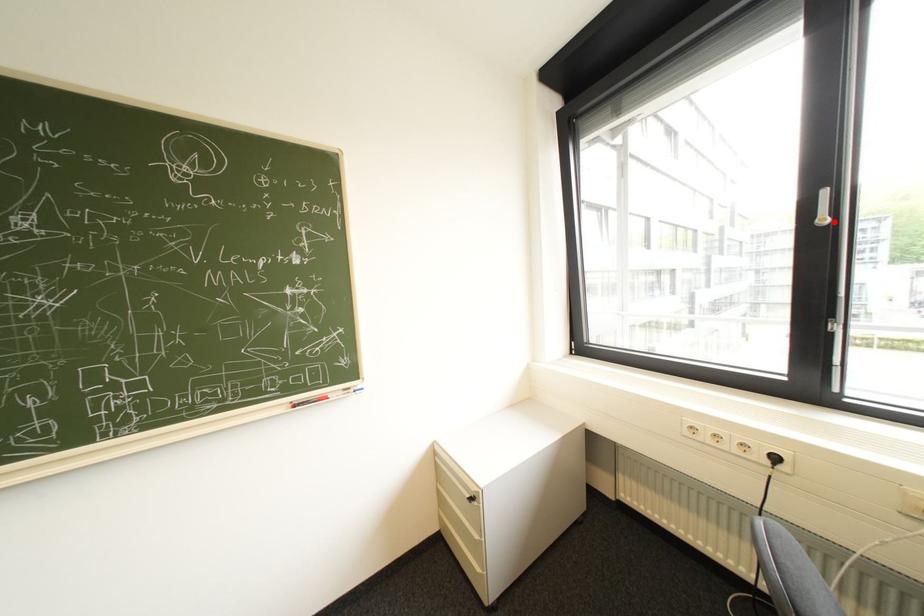
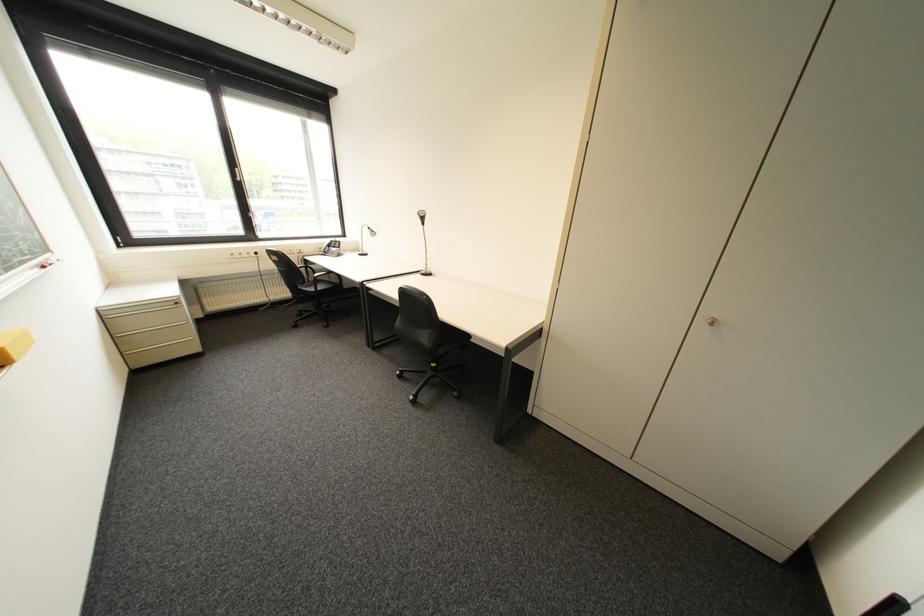
Question: A red point is marked in image1. In image2, is the corresponding 3D point closer to the camera or farther? Reply with the corresponding letter.

Choices:
 (A) The corresponding 3D point is closer.
 (B) The corresponding 3D point is farther.

Answer: (A)